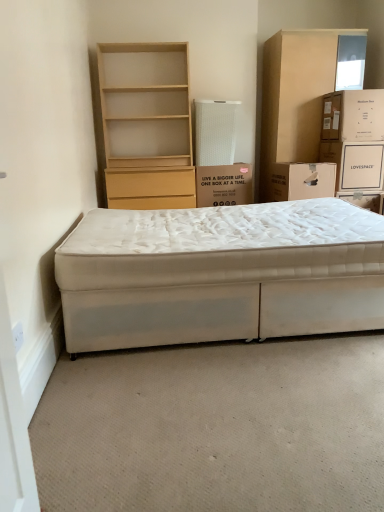
Question: From the image's perspective, relative to white cardboard box at center, which is the first box in left-to-right order, is white cardboard box at upper right above or below?

Choices:
 (A) above
 (B) below

Answer: (A)

Question: In terms of width, does white cardboard box at upper right look wider or thinner when compared to white cardboard box at center, which is the first box in left-to-right order?

Choices:
 (A) thin
 (B) wide

Answer: (A)

Question: Which object is the farthest from the white fabric bed at lower center?

Choices:
 (A) light wood/finely finished bookshelf at upper left
 (B) white cardboard box at right, the second box positioned from the right
 (C) white cardboard box at upper right
 (D) beige cardboard cabinet at upper right
 (E) medium brown cardboard box at upper right, arranged as the 3th box when viewed from the left

Answer: (D)

Question: Considering the real-world distances, which object is closest to the beige cardboard cabinet at upper right?

Choices:
 (A) white cardboard box at right, arranged as the second box when viewed from the left
 (B) light wood/finely finished bookshelf at upper left
 (C) white fabric bed at lower center
 (D) medium brown cardboard box at upper right, arranged as the 3th box when viewed from the left
 (E) white cardboard box at upper right

Answer: (D)